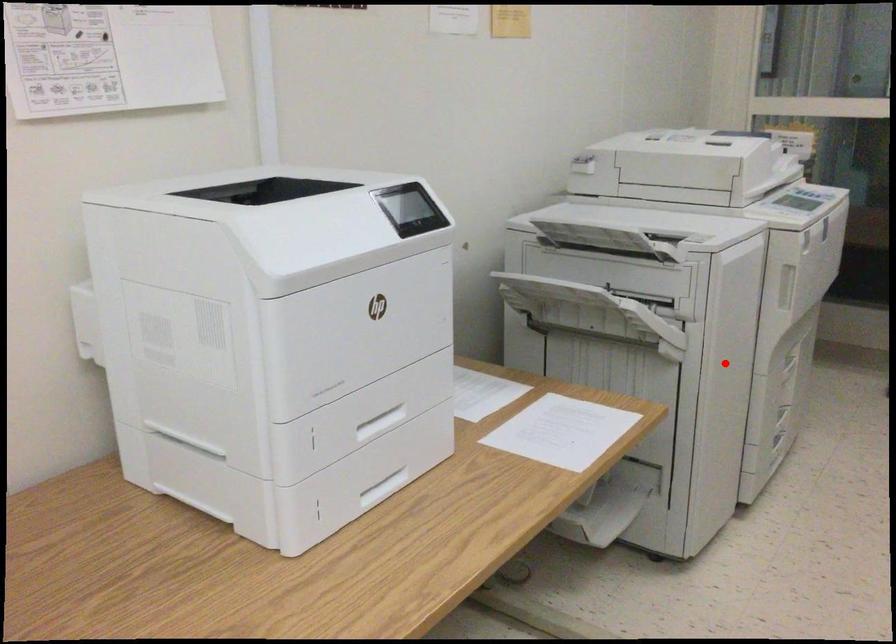
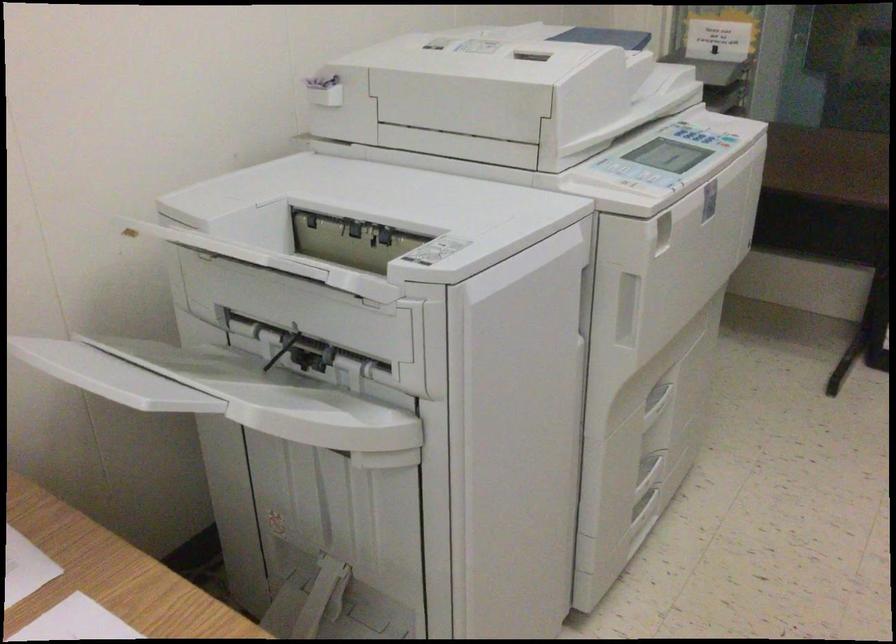
Where in the second image is the point corresponding to the highlighted location from the first image?

(506, 453)